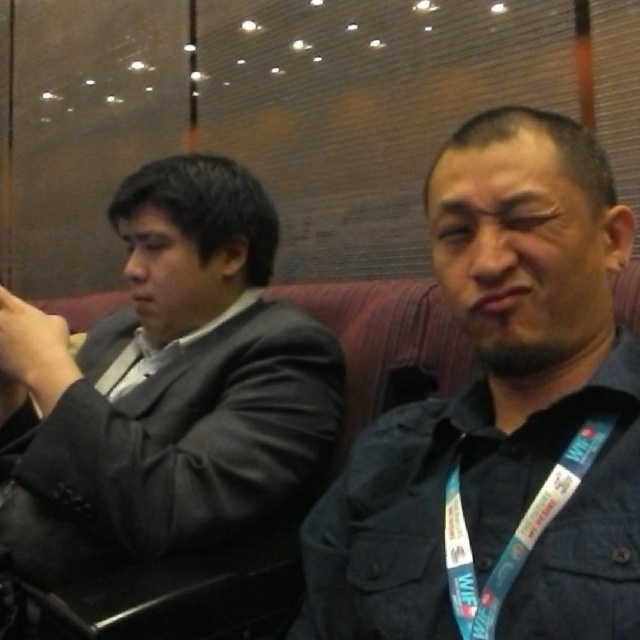
You are organizing a charity event and need to pack items into a small box that can only hold items smaller than the dark blue denim jacket at center. Can the blue fabric lanyard at right fit into the box?

The dark blue denim jacket at center is bigger than the blue fabric lanyard at right, so the blue fabric lanyard at right can fit into the box since it is smaller than the jacket.

You are a photographer positioned at the camera. You want to capture a closeup shot of the dark blue denim jacket at center without moving your position. Can you do this with a standard zoom lens that has a minimum focusing distance of 50 centimeters?

The dark blue denim jacket at center is 49.55 centimeters from the camera. Since the minimum focusing distance of the standard zoom lens is 50 centimeters, the photographer cannot capture a closeup shot without moving closer because the jacket is slightly closer than the lens allows.

You are a photographer adjusting your camera settings to capture the two subjects in the scene. Which object, the matte black suit at left or the blue fabric lanyard at right, is closer to the camera?

The matte black suit at left is closer to the camera than the blue fabric lanyard at right.